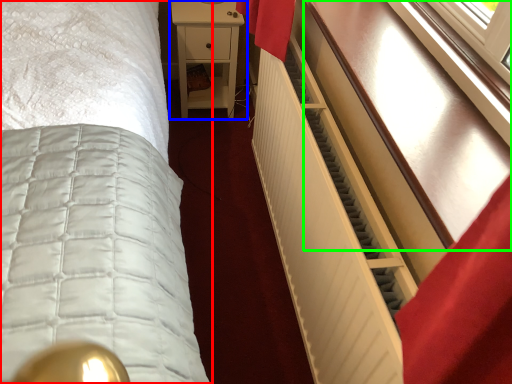
Question: Estimate the real-world distances between objects in this image. Which object is closer to bed (highlighted by a red box), nightstand (highlighted by a blue box) or vanity (highlighted by a green box)?

Choices:
 (A) nightstand
 (B) vanity

Answer: (B)